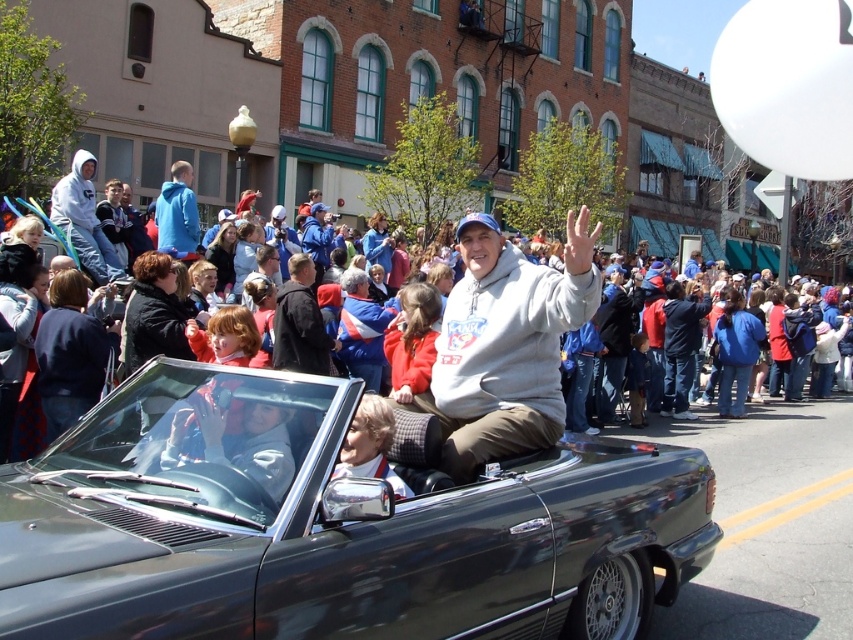
Question: Can you confirm if shiny black convertible at center is positioned above matte gray hoodie at left?

Choices:
 (A) yes
 (B) no

Answer: (B)

Question: Can you confirm if gray fleece sweatshirt at center is positioned to the left of red jackets at center?

Choices:
 (A) no
 (B) yes

Answer: (B)

Question: Considering the relative positions of matte gray hoodie at left and blue fleece jacket at upper left in the image provided, where is matte gray hoodie at left located with respect to blue fleece jacket at upper left?

Choices:
 (A) below
 (B) above

Answer: (A)

Question: Which point is closer to the camera taking this photo?

Choices:
 (A) (373, 484)
 (B) (97, 269)
 (C) (477, 376)

Answer: (A)

Question: Based on their relative distances, which object is farther from the gray fleece sweatshirt at center?

Choices:
 (A) matte gray hoodie at left
 (B) red jackets at center
 (C) shiny black convertible at center

Answer: (B)

Question: Which point is closer to the camera taking this photo?

Choices:
 (A) (439, 413)
 (B) (181, 163)

Answer: (A)